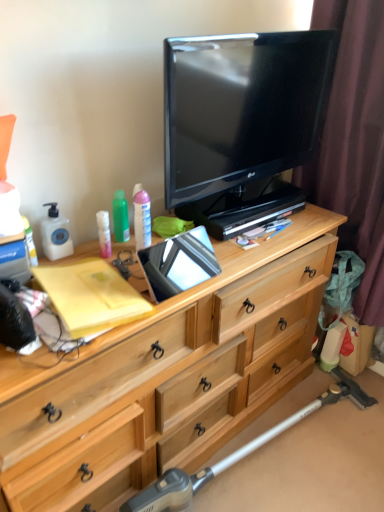
Locate an element on the screen. This screenshot has height=512, width=384. vacant space situated on the left part of matte plastic lotion at center, which is counted as the 1th toiletry, starting from the right is located at coordinates (91, 250).